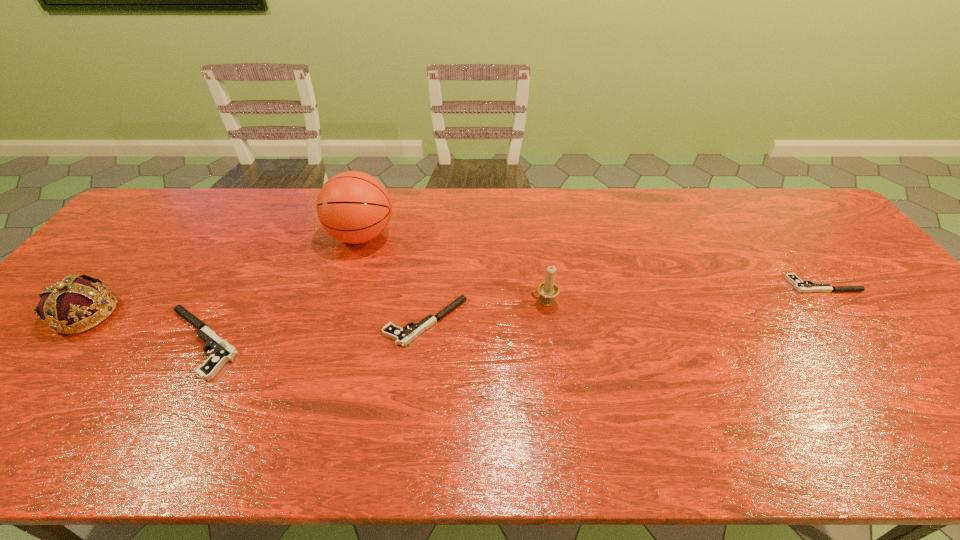
Identify the location of free space located 0.280m on the front-facing side of the leftmost pistol. (43, 342).

Locate an element on the screen. The image size is (960, 540). vacant area located on the front-facing side of the leftmost pistol is located at coordinates (60, 342).

Where is `free spot located on the front-facing side of the second tallest pistol`? This screenshot has width=960, height=540. free spot located on the front-facing side of the second tallest pistol is located at coordinates (306, 322).

Identify the location of vacant space situated on the front-facing side of the second tallest pistol. (240, 322).

In order to click on vacant space located on the front-facing side of the second tallest pistol in this screenshot , I will do `click(330, 322)`.

You are a GUI agent. You are given a task and a screenshot of the screen. Output one action in this format:
    pyautogui.click(x=<x>, y=<y>)
    Task: Click on the free spot located 0.080m on the front-facing side of the shortest pistol
    
    Given the screenshot: What is the action you would take?
    pyautogui.click(x=759, y=285)

Find the location of a particular element. Image resolution: width=960 pixels, height=540 pixels. vacant space located 0.320m on the front-facing side of the shortest pistol is located at coordinates (673, 285).

Locate an element on the screen. This screenshot has width=960, height=540. vacant region located on the front-facing side of the shortest pistol is located at coordinates (716, 285).

Find the location of a particular element. vacant space located on the left of the basketball is located at coordinates (234, 235).

The image size is (960, 540). I want to click on vacant space situated 0.300m on the back of the crown, so click(161, 223).